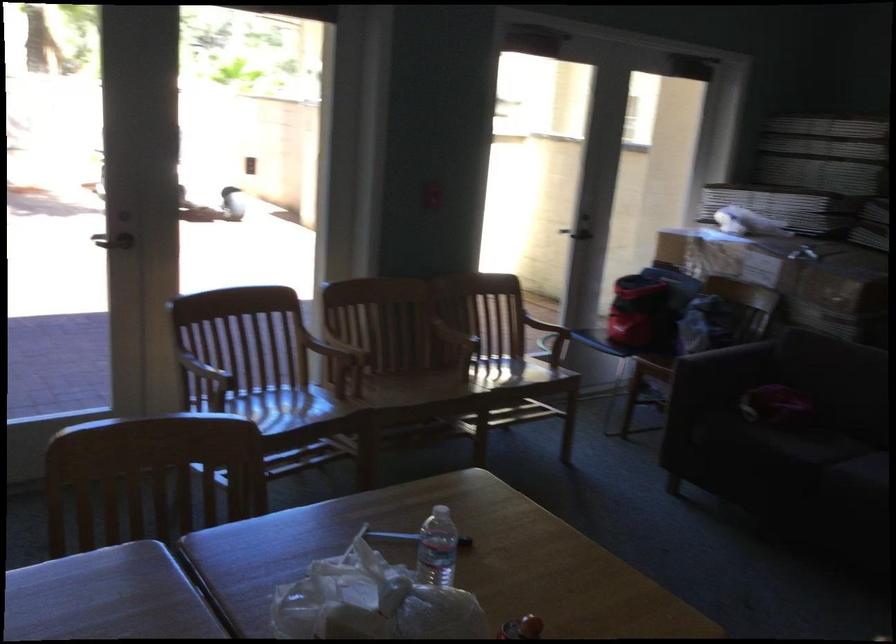
Find the location of a particular element. The height and width of the screenshot is (644, 896). sofa armrest is located at coordinates (673, 488).